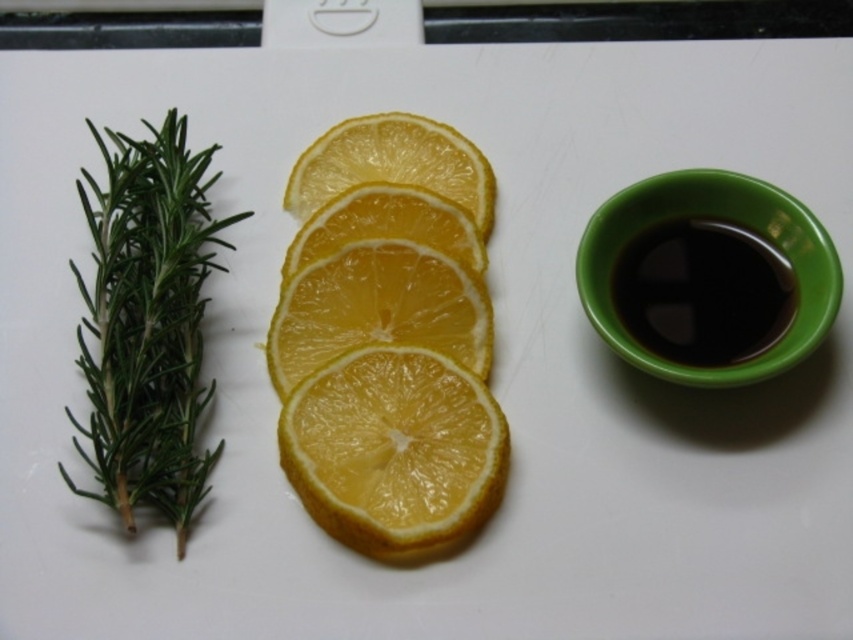
Question: Which object appears closest to the camera in this image?

Choices:
 (A) yellow smooth orange at center
 (B) green needle-like rosemary at left
 (C) yellow matte lemon at center
 (D) yellow translucent orange slices at center

Answer: (B)

Question: In this image, where is green needle-like rosemary at left located relative to yellow translucent orange slices at center?

Choices:
 (A) below
 (B) above

Answer: (A)

Question: Does green needle-like rosemary at left have a larger size compared to yellow matte lemon at center?

Choices:
 (A) yes
 (B) no

Answer: (A)

Question: Which object is closer to the camera taking this photo?

Choices:
 (A) yellow matte orange at center
 (B) yellow matte lemon at center
 (C) yellow translucent orange slices at center
 (D) green needle-like rosemary at left

Answer: (D)

Question: Which of the following is the farthest from the observer?

Choices:
 (A) (308, 266)
 (B) (381, 496)
 (C) (766, 344)

Answer: (A)

Question: Can you confirm if green needle-like rosemary at left is positioned to the left of black glossy coffee at right?

Choices:
 (A) yes
 (B) no

Answer: (A)